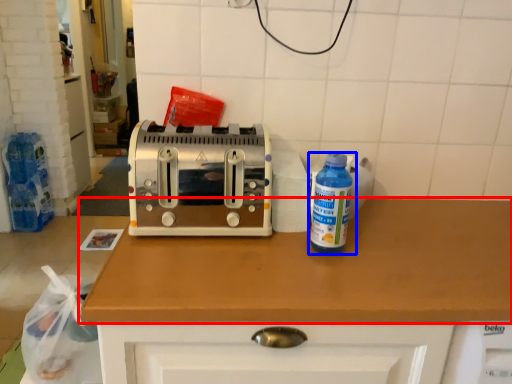
Question: Which object is closer to the camera taking this photo, countertop (highlighted by a red box) or bottle (highlighted by a blue box)?

Choices:
 (A) countertop
 (B) bottle

Answer: (A)